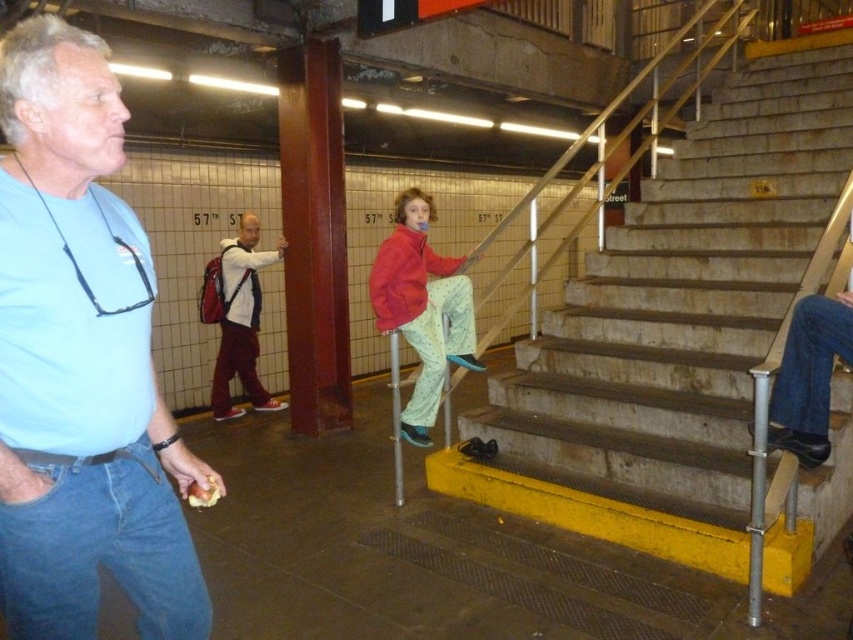
Question: Is light blue t-shirt at left wider than red fleece jacket at center?

Choices:
 (A) no
 (B) yes

Answer: (A)

Question: Which object is farther from the camera taking this photo?

Choices:
 (A) red fleece jacket at center
 (B) concrete stairs at center
 (C) light blue t-shirt at left

Answer: (A)

Question: Is concrete stairs at center wider than red fleece jacket at center?

Choices:
 (A) yes
 (B) no

Answer: (A)

Question: Is concrete stairs at center bigger than light blue t-shirt at left?

Choices:
 (A) no
 (B) yes

Answer: (B)

Question: Which of the following is the closest to the observer?

Choices:
 (A) light blue t-shirt at left
 (B) concrete stairs at center
 (C) red fleece jacket at center

Answer: (A)

Question: Estimate the real-world distances between objects in this image. Which object is farther from the red fleece jacket at center?

Choices:
 (A) concrete stairs at center
 (B) light blue t-shirt at left

Answer: (B)